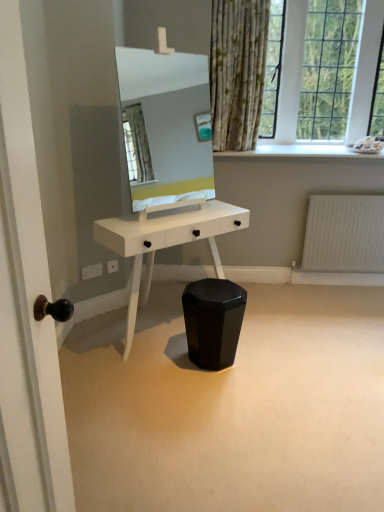
At what (x,y) coordinates should I click in order to perform the action: click on free space in front of black glossy stool at center. Please return your answer as a coordinate pair (x, y). Looking at the image, I should click on [223, 392].